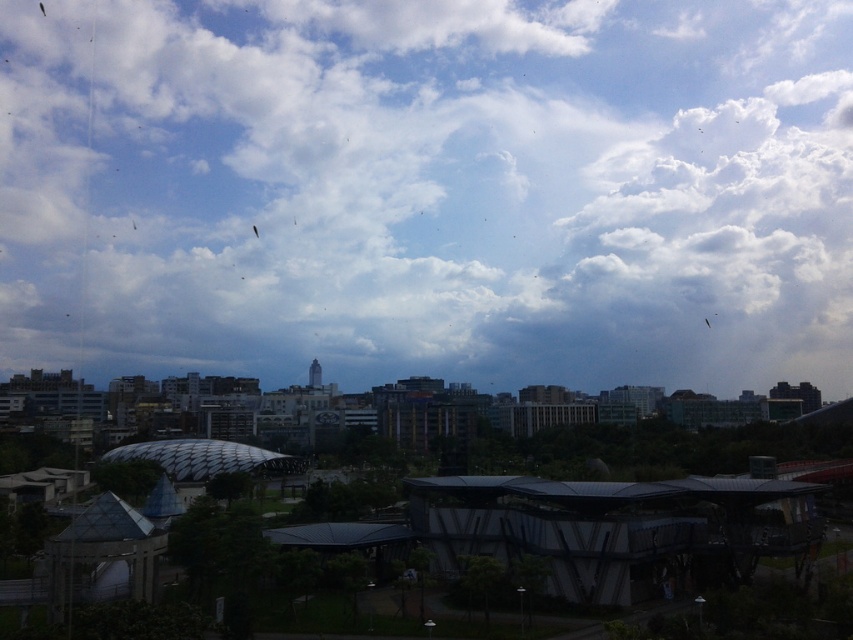
Can you confirm if white fluffy cloud at upper center is positioned to the left of translucent plastic kite at upper center?

No, white fluffy cloud at upper center is not to the left of translucent plastic kite at upper center.

Is point (672, 252) closer to viewer compared to point (257, 234)?

No, (672, 252) is further to viewer.

Find the location of `white fluffy cloud at upper center`. white fluffy cloud at upper center is located at coordinates (428, 189).